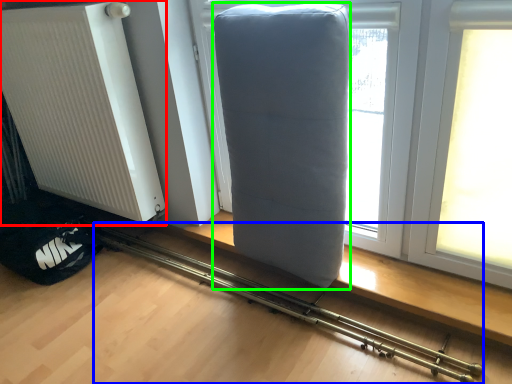
Question: Which is farther away from radiator (highlighted by a red box)? equipment (highlighted by a blue box) or furniture (highlighted by a green box)?

Choices:
 (A) equipment
 (B) furniture

Answer: (B)